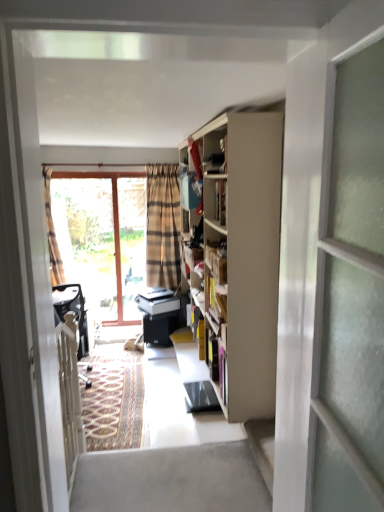
Question: Is point [x=268, y=458] closer or farther from the camera than point [x=223, y=150]?

Choices:
 (A) closer
 (B) farther

Answer: (A)

Question: From a real-world perspective, is smooth concrete step at lower right above or below matte wooden cabinet at upper center?

Choices:
 (A) below
 (B) above

Answer: (A)

Question: Estimate the real-world distances between objects in this image. Which object is closer to the smooth concrete step at lower right?

Choices:
 (A) matte wooden cabinet at upper center
 (B) plaid fabric curtain at left
 (C) translucent glass window at left
 (D) transparent glass screen door at right

Answer: (D)

Question: Considering the real-world distances, which object is closest to the smooth concrete step at lower right?

Choices:
 (A) translucent glass window at left
 (B) plaid fabric curtain at left
 (C) matte wooden cabinet at upper center
 (D) transparent glass screen door at right

Answer: (D)